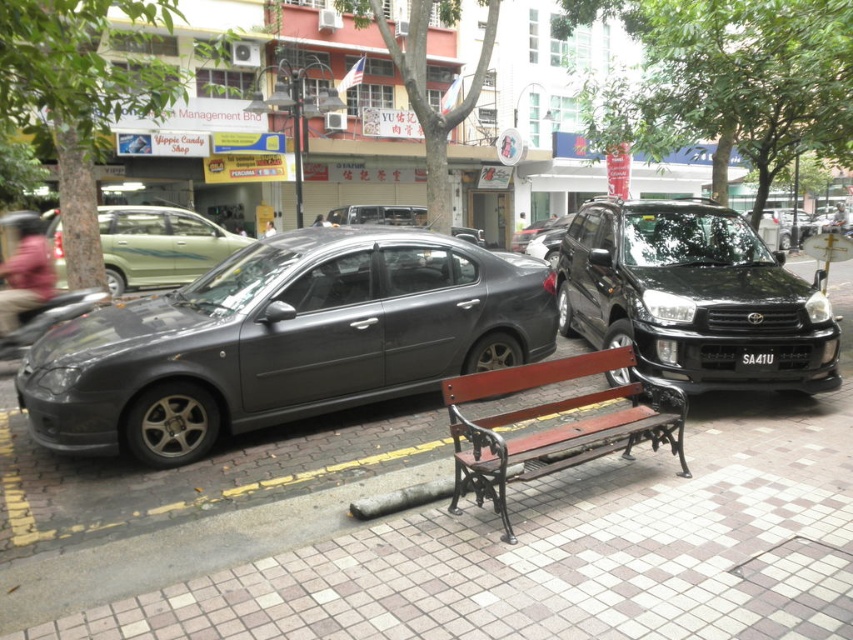
Question: Is brown tile pavement at center further to the viewer compared to matte gray sedan at center-left?

Choices:
 (A) no
 (B) yes

Answer: (A)

Question: Considering the relative positions of brown tile pavement at center and black metallic sedan at right in the image provided, where is brown tile pavement at center located with respect to black metallic sedan at right?

Choices:
 (A) right
 (B) left

Answer: (B)

Question: From the image, what is the correct spatial relationship of brown tile pavement at center in relation to black metallic sedan at right?

Choices:
 (A) above
 (B) below

Answer: (B)

Question: Which object appears closest to the camera in this image?

Choices:
 (A) matte gray sedan at center-left
 (B) black metallic sedan at right
 (C) wooden bench at center

Answer: (C)

Question: Estimate the real-world distances between objects in this image. Which object is farther from the black metallic sedan at right?

Choices:
 (A) matte gray sedan at center
 (B) matte gray sedan at center-left
 (C) black plastic license plate at center

Answer: (A)

Question: Which object appears closest to the camera in this image?

Choices:
 (A) black metallic sedan at right
 (B) matte gray sedan at center-left
 (C) brown tile pavement at center
 (D) matte gray sedan at center

Answer: (C)